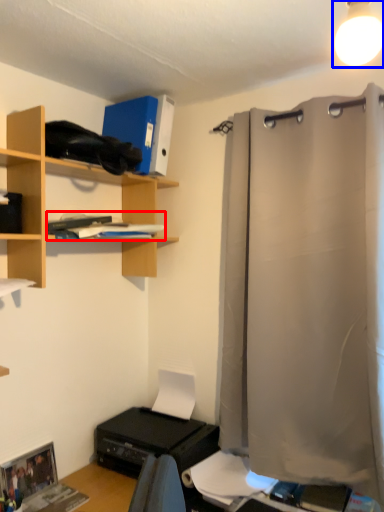
Question: Which point is closer to the camera, book (highlighted by a red box) or light fixture (highlighted by a blue box)?

Choices:
 (A) book
 (B) light fixture

Answer: (B)